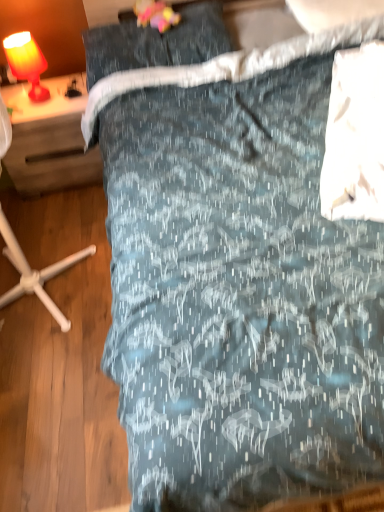
Question: Is matte wood desk at left in front of or behind dark gray fabric pillow at upper center in the image?

Choices:
 (A) behind
 (B) front

Answer: (A)

Question: In terms of height, does matte wood desk at left look taller or shorter compared to dark gray fabric pillow at upper center?

Choices:
 (A) short
 (B) tall

Answer: (B)

Question: Which object is positioned closest to the dark gray fabric pillow at upper center?

Choices:
 (A) matte wood desk at left
 (B) matte orange lamp at upper left

Answer: (A)

Question: Based on their relative distances, which object is nearer to the matte wood desk at left?

Choices:
 (A) matte orange lamp at upper left
 (B) dark gray fabric pillow at upper center

Answer: (A)